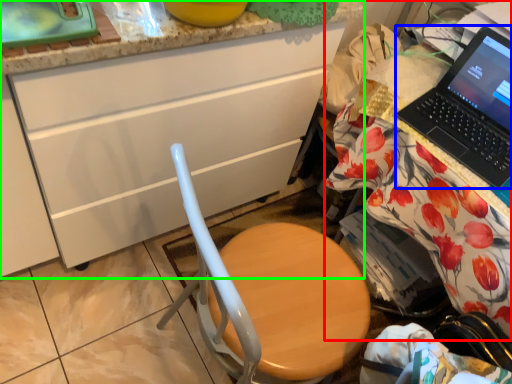
Question: Which object is positioned farthest from desk (highlighted by a red box)? Select from laptop (highlighted by a blue box) and cabinetry (highlighted by a green box).

Choices:
 (A) laptop
 (B) cabinetry

Answer: (B)